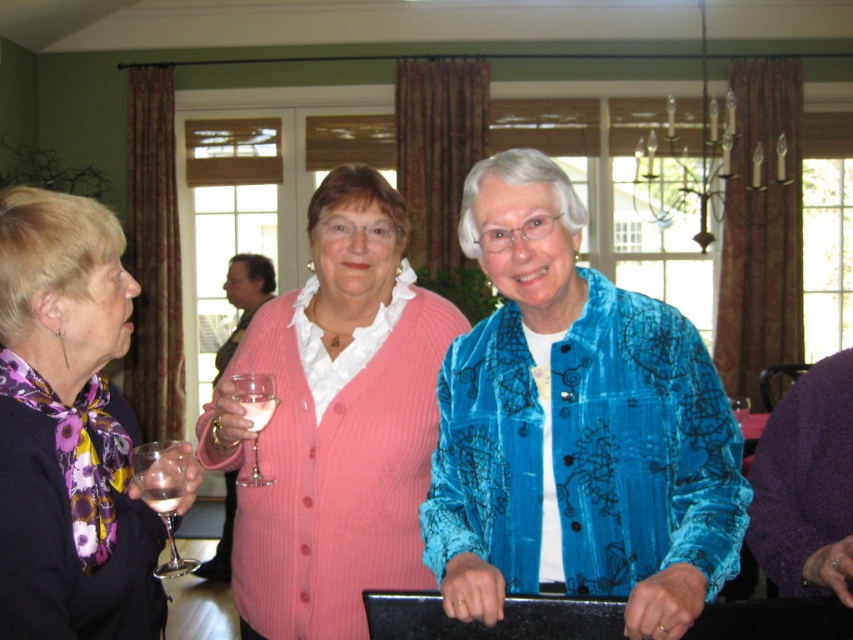
Does clear glass wine glass at center appear on the left side of clear glass wine at center?

Correct, you'll find clear glass wine glass at center to the left of clear glass wine at center.

Is clear glass wine glass at center bigger than clear glass wine at center?

Yes, clear glass wine glass at center is bigger than clear glass wine at center.

Where is `clear glass wine glass at center`? Image resolution: width=853 pixels, height=640 pixels. clear glass wine glass at center is located at coordinates (254, 417).

Where is `clear glass wine glass at center`? This screenshot has width=853, height=640. clear glass wine glass at center is located at coordinates (254, 417).

Who is positioned more to the right, pink ribbed sweater at center or floral scarf at left?

pink ribbed sweater at center is more to the right.

Who is lower down, pink ribbed sweater at center or floral scarf at left?

pink ribbed sweater at center is below.

Is point (320, 401) farther from camera compared to point (119, 308)?

Yes, it is behind point (119, 308).

Locate an element on the screen. pink ribbed sweater at center is located at coordinates (335, 422).

Who is more forward, (503, 536) or (80, 285)?

Positioned in front is point (80, 285).

The height and width of the screenshot is (640, 853). In order to click on velvet blue jacket at center in this screenshot , I will do click(575, 428).

Is point (517, 236) positioned after point (138, 499)?

No, it is in front of (138, 499).

Identify the location of velvet blue jacket at center. (575, 428).